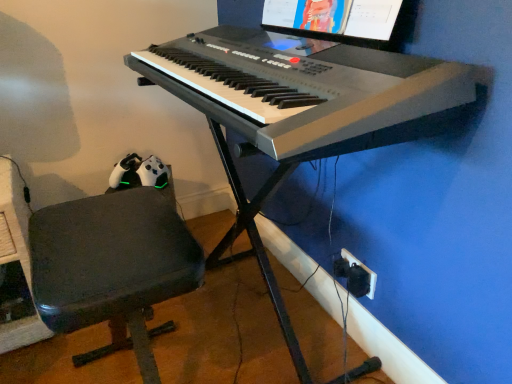
Identify the location of vacant region in front of matte black monitor at upper center. (382, 56).